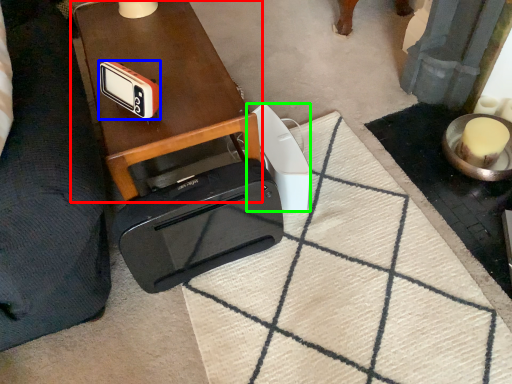
Question: Which object is positioned farthest from table (highlighted by a red box)? Select from gadget (highlighted by a blue box) and gadget (highlighted by a green box).

Choices:
 (A) gadget
 (B) gadget

Answer: (B)